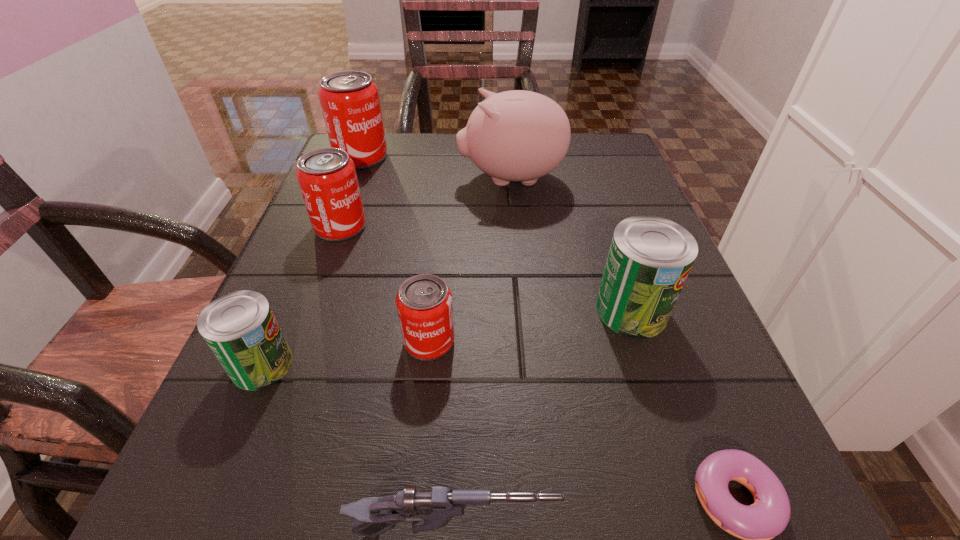
This screenshot has width=960, height=540. In order to click on red can object that ranks as the third closest to the doughnut in this screenshot , I will do `click(349, 100)`.